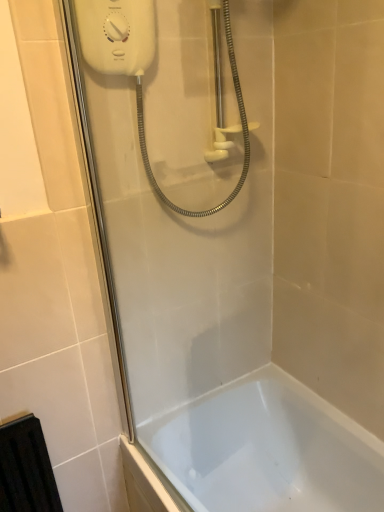
Question: From the image's perspective, relative to white glossy shower door at upper left, is white glossy bathtub at lower center above or below?

Choices:
 (A) above
 (B) below

Answer: (B)

Question: Considering the relative positions of white glossy bathtub at lower center and white glossy shower door at upper left in the image provided, is white glossy bathtub at lower center to the left or to the right of white glossy shower door at upper left?

Choices:
 (A) left
 (B) right

Answer: (B)

Question: Which is farther from the white plastic shower at upper center?

Choices:
 (A) white glossy shower door at upper left
 (B) white glossy bathtub at lower center

Answer: (B)

Question: Considering the real-world distances, which object is farthest from the white glossy shower door at upper left?

Choices:
 (A) white glossy bathtub at lower center
 (B) white plastic shower at upper center

Answer: (A)